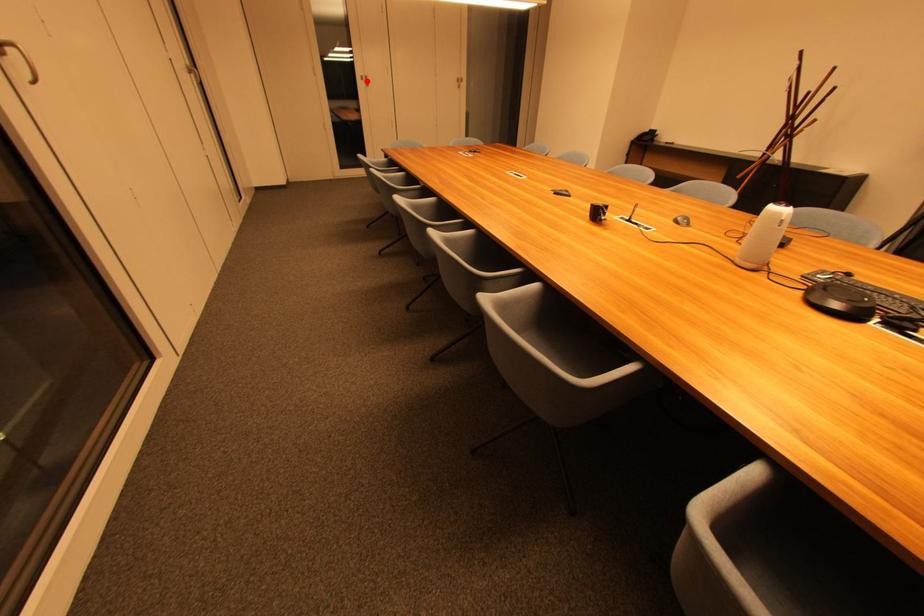
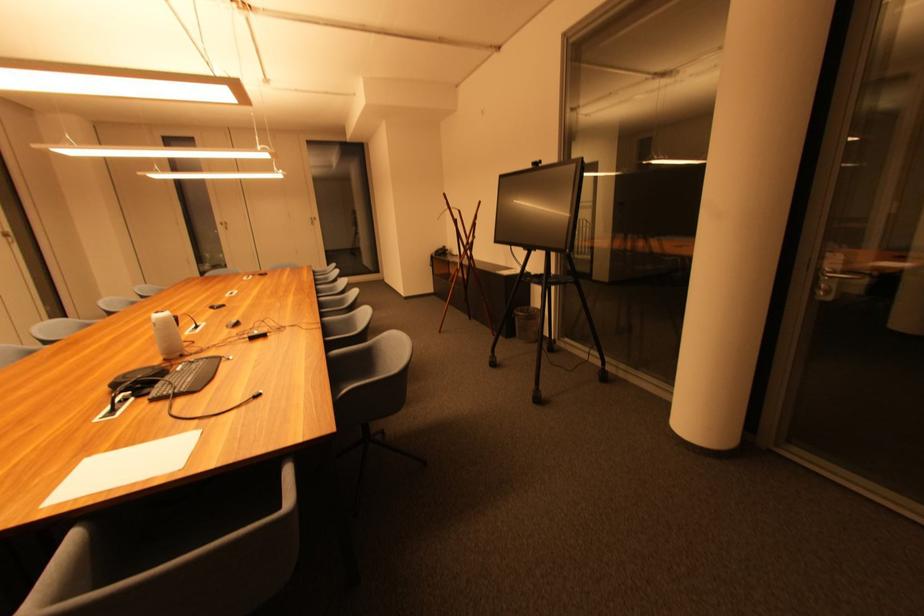
Find the pixel in the second image that matches the highlighted location in the first image.

(226, 225)